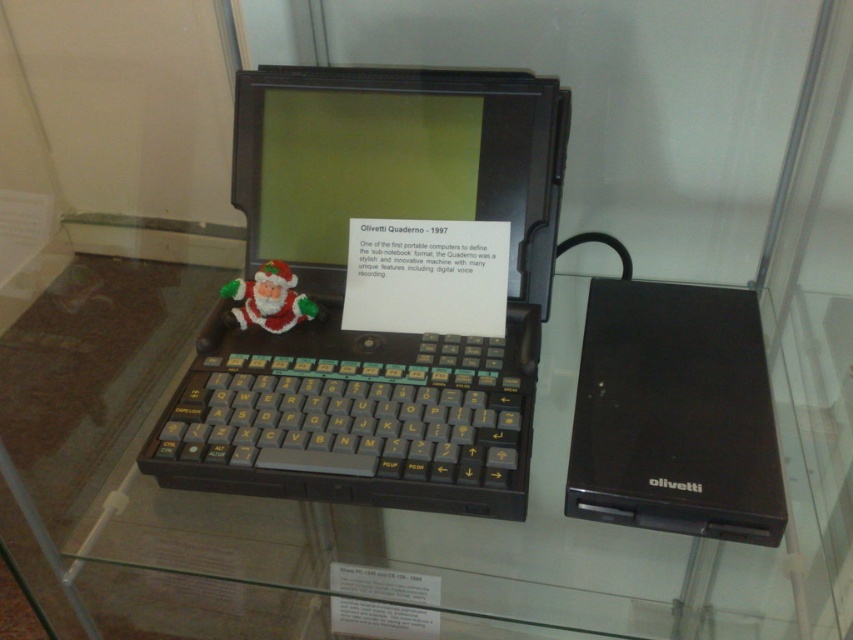
Looking at this image, you are a museum visitor observing the vintage laptop exhibit. You see the black plastic laptop at right and the felt santa claus at center. Which object is located to the right of the other?

The black plastic laptop at right is positioned on the right side of felt santa claus at center, so the laptop is to the right of the Santa Claus figurine.

You are a museum visitor holding a 12 inch wide gift box. You want to place it on the transparent glass table at center. Is the table within your reach? Please explain your reasoning.

The transparent glass table at center is 23.32 inches from the camera. Since the gift box is 12 inches wide, the distance from the camera does not directly indicate whether the table is within reach. However, assuming the camera is positioned at eye level, the table is likely within a comfortable reaching distance for most adults.